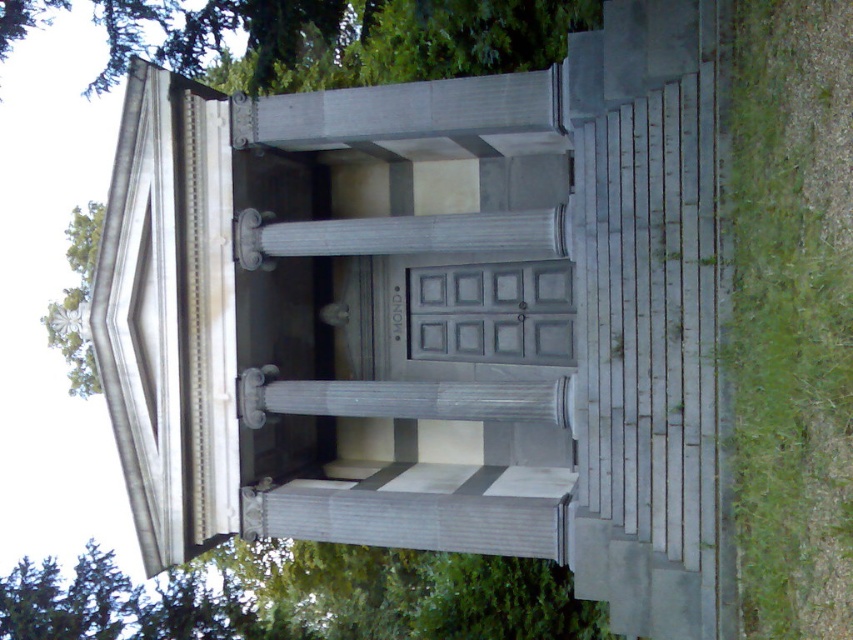
You are a GUI agent. You are given a task and a screenshot of the screen. Output one action in this format:
    pyautogui.click(x=<x>, y=<y>)
    Task: Click on the green leafy tree at lower left
    This screenshot has height=640, width=853.
    Given the screenshot: What is the action you would take?
    pyautogui.click(x=300, y=600)

Which of these two, green leafy tree at lower left or green leafy tree at upper left, stands shorter?

green leafy tree at lower left is shorter.

Is point (415, 630) positioned in front of point (76, 220)?

Yes, point (415, 630) is closer to viewer.

You are a GUI agent. You are given a task and a screenshot of the screen. Output one action in this format:
    pyautogui.click(x=<x>, y=<y>)
    Task: Click on the green leafy tree at lower left
    
    Given the screenshot: What is the action you would take?
    pyautogui.click(x=300, y=600)